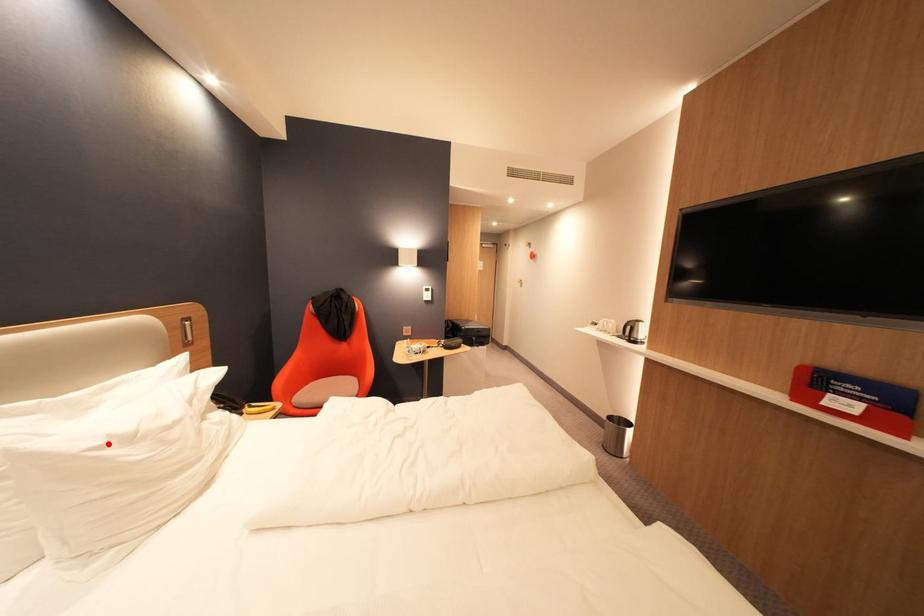
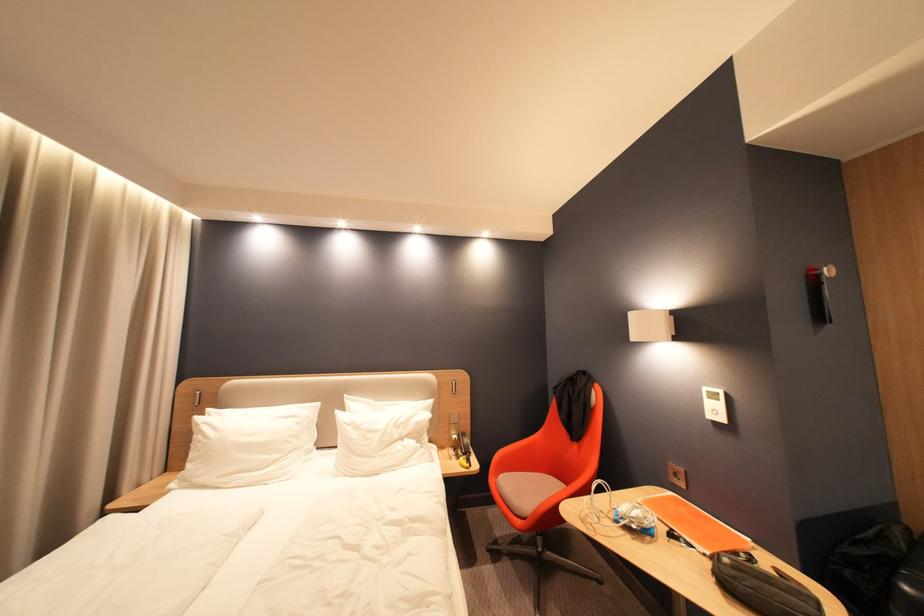
In the second image, find the point that corresponds to the highlighted location in the first image.

(359, 424)